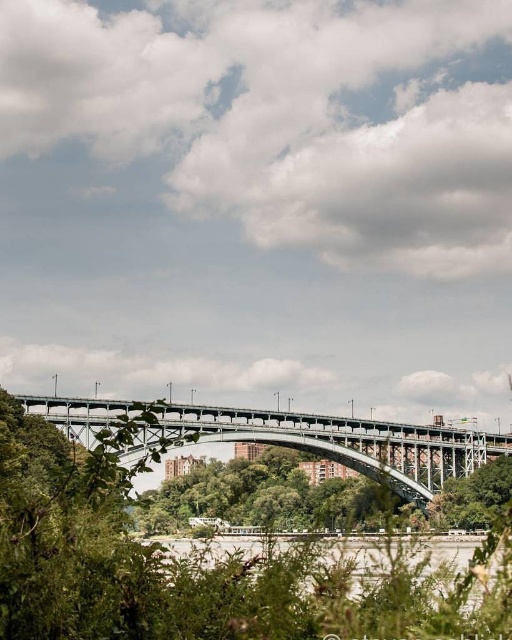
Who is more distant from viewer, (54, 544) or (384, 563)?

Point (384, 563)

At what (x,y) coordinates should I click in order to perform the action: click on green leafy tree at center. Please return your answer as a coordinate pair (x, y). The width and height of the screenshot is (512, 640). Looking at the image, I should click on (187, 564).

Who is more forward, (278, 636) or (153, 570)?

Point (278, 636) is more forward.

The width and height of the screenshot is (512, 640). I want to click on green leafy tree at center, so click(x=187, y=564).

Does point (192, 616) come closer to viewer compared to point (472, 442)?

Yes, point (192, 616) is in front of point (472, 442).

What do you see at coordinates (187, 564) in the screenshot?
I see `green leafy tree at center` at bounding box center [187, 564].

Find the location of a particular element. green leafy tree at center is located at coordinates (187, 564).

Based on the photo, can you confirm if gray concrete river at center is taller than metallic gray bridge at center?

No.

Does point (424, 552) come closer to viewer compared to point (415, 500)?

Yes, point (424, 552) is in front of point (415, 500).

Measure the distance between point [377,614] and camera.

A distance of 98.40 meters exists between point [377,614] and camera.

Identify the location of gray concrete river at center. (323, 589).